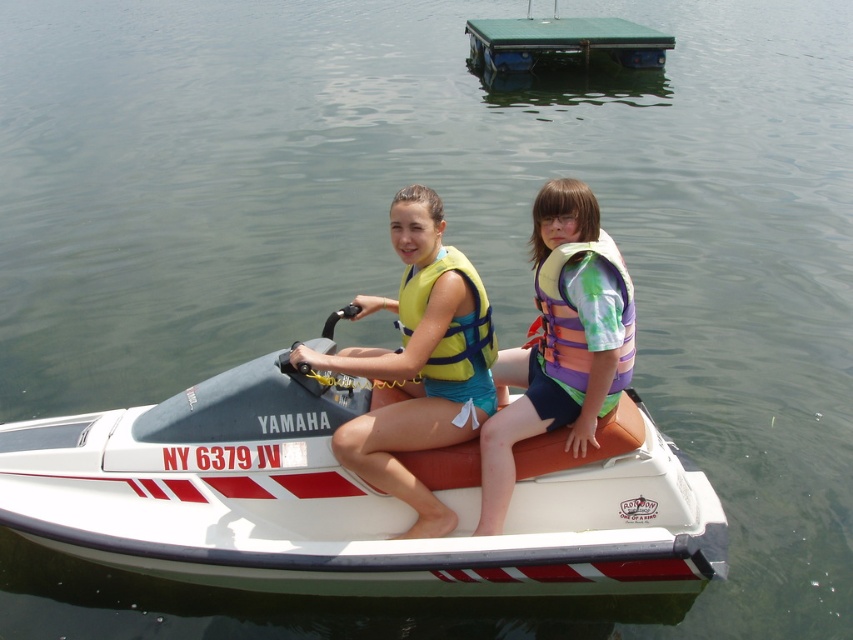
Consider the image. Which is more to the right, white matte jet ski at center or yellow life vest at center?

From the viewer's perspective, yellow life vest at center appears more on the right side.

Is white matte jet ski at center closer to the viewer compared to yellow life vest at center?

Yes, white matte jet ski at center is in front of yellow life vest at center.

Which is in front, point (474, 474) or point (372, 440)?

Positioned in front is point (372, 440).

You are a GUI agent. You are given a task and a screenshot of the screen. Output one action in this format:
    pyautogui.click(x=<x>, y=<y>)
    Task: Click on the white matte jet ski at center
    Image resolution: width=853 pixels, height=640 pixels.
    Given the screenshot: What is the action you would take?
    pyautogui.click(x=351, y=499)

Is yellow life vest at center above multicolored life vest at center?

Correct, yellow life vest at center is located above multicolored life vest at center.

At what (x,y) coordinates should I click in order to perform the action: click on yellow life vest at center. Please return your answer as a coordinate pair (x, y). Looking at the image, I should click on (416, 362).

Does multicolored fabric life jacket at center have a larger size compared to yellow fabric life jacket at center?

Correct, multicolored fabric life jacket at center is larger in size than yellow fabric life jacket at center.

Does multicolored fabric life jacket at center appear on the left side of yellow fabric life jacket at center?

No, multicolored fabric life jacket at center is not to the left of yellow fabric life jacket at center.

Between point (578, 388) and point (444, 371), which one is positioned in front?

Positioned in front is point (578, 388).

At what (x,y) coordinates should I click in order to perform the action: click on multicolored fabric life jacket at center. Please return your answer as a coordinate pair (x, y). Image resolution: width=853 pixels, height=640 pixels. Looking at the image, I should click on (578, 316).